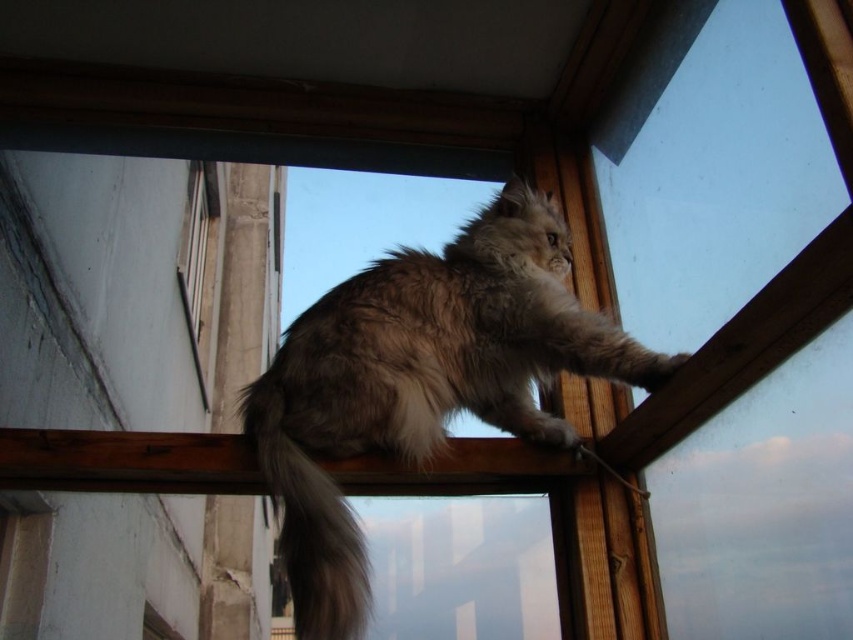
You are trying to determine if the fuzzy fur cat at upper center can fit through the transparent plastic window at center. Based on their sizes, is it possible?

The fuzzy fur cat at upper center is much taller than the transparent plastic window at center, so it cannot fit through the window.